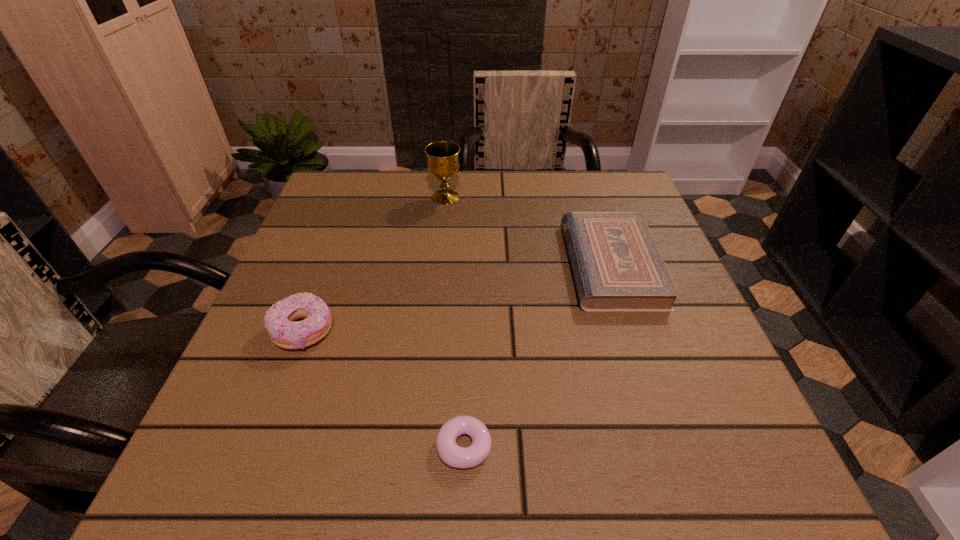
In the image, there is a desktop. Identify the location of free space at the left edge. (300, 291).

This screenshot has height=540, width=960. Identify the location of free point at the right edge. (730, 427).

Image resolution: width=960 pixels, height=540 pixels. I want to click on free space at the far left corner of the desktop, so click(x=374, y=205).

At what (x,y) coordinates should I click in order to perform the action: click on free space at the near left corner of the desktop. Please return your answer as a coordinate pair (x, y). This screenshot has height=540, width=960. Looking at the image, I should click on (291, 448).

Identify the location of free space at the far right corner of the desktop. (586, 184).

I want to click on empty location between the nearest object and the tallest object, so click(455, 322).

I want to click on free point between the farthest object and the nearest object, so click(455, 322).

Locate an element on the screen. free spot between the nearer doughnut and the third tallest object is located at coordinates (538, 355).

The image size is (960, 540). Find the location of `vacant space that is in between the left doughnut and the rightmost object`. vacant space that is in between the left doughnut and the rightmost object is located at coordinates (457, 298).

Locate an element on the screen. vacant point located between the farthest object and the left doughnut is located at coordinates (374, 264).